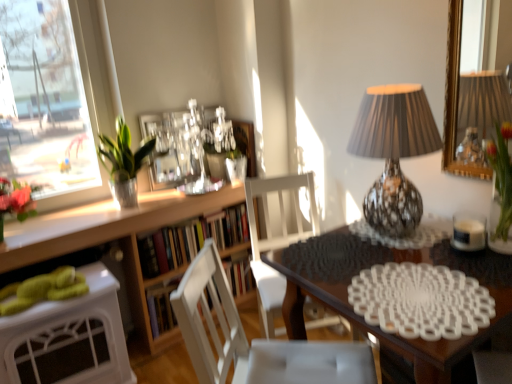
Where is `vacant space positioned to the left of green glass vase at upper right`? This screenshot has height=384, width=512. vacant space positioned to the left of green glass vase at upper right is located at coordinates (448, 247).